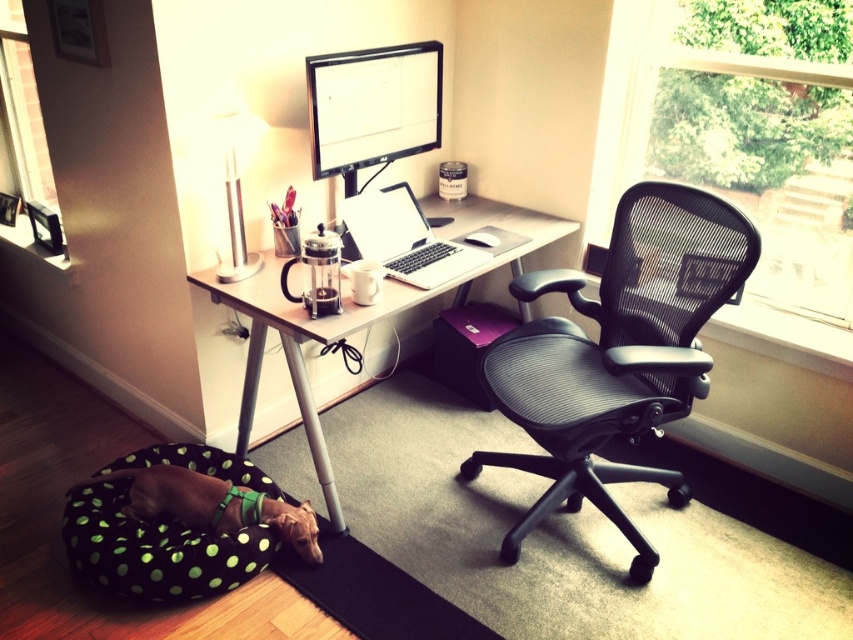
Which is more to the right, transparent mesh chair at right or green dotted fabric dog bed at lower left?

Positioned to the right is transparent mesh chair at right.

Is point (802, 81) positioned in front of point (293, 531)?

No, it is behind (293, 531).

Find the location of a particular element. transparent mesh chair at right is located at coordinates (795, 278).

At what (x,y) coordinates should I click in order to perform the action: click on transparent mesh chair at right. Please return your answer as a coordinate pair (x, y). Looking at the image, I should click on (795, 278).

Can you confirm if transparent mesh chair at right is positioned to the right of satin silver laptop at center?

Yes, transparent mesh chair at right is to the right of satin silver laptop at center.

Between point (844, 88) and point (381, 248), which one is positioned behind?

Point (381, 248)

At what (x,y) coordinates should I click in order to perform the action: click on transparent mesh chair at right. Please return your answer as a coordinate pair (x, y). The image size is (853, 640). Looking at the image, I should click on (795, 278).

Is point (625, 138) farther from camera compared to point (404, 104)?

Yes.

The width and height of the screenshot is (853, 640). I want to click on transparent mesh chair at right, so click(x=795, y=278).